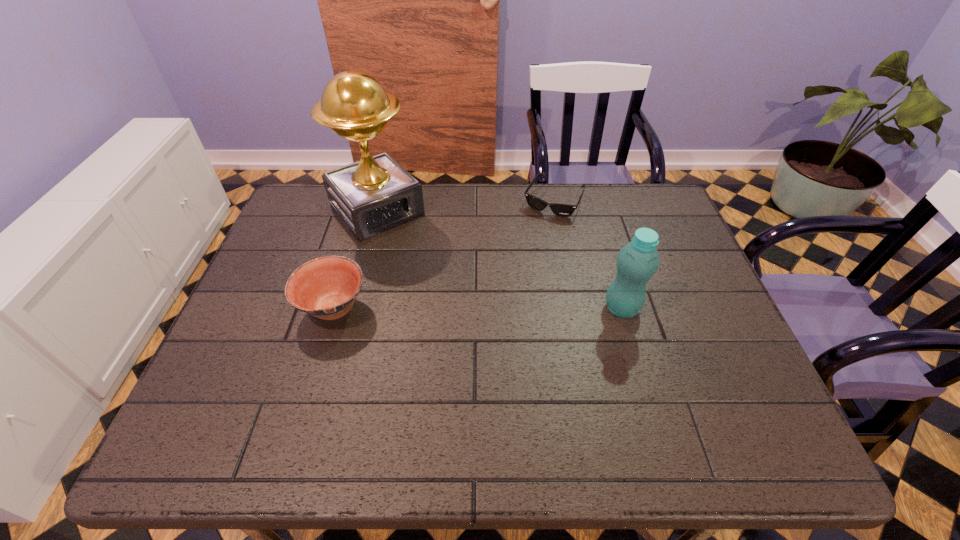
Where is `free location at the far left corner of the desktop`? The height and width of the screenshot is (540, 960). free location at the far left corner of the desktop is located at coordinates (322, 213).

Where is `vacant point at the far right corner`? This screenshot has width=960, height=540. vacant point at the far right corner is located at coordinates (637, 192).

Where is `vacant space at the near right corner of the desktop`? vacant space at the near right corner of the desktop is located at coordinates (702, 376).

This screenshot has width=960, height=540. I want to click on empty space that is in between the water bottle and the shortest object, so click(x=588, y=254).

This screenshot has width=960, height=540. What are the coordinates of `vacant area between the bowl and the water bottle` in the screenshot? It's located at (477, 308).

Find the location of a particular element. This screenshot has height=540, width=960. free space between the award and the bowl is located at coordinates (355, 259).

The height and width of the screenshot is (540, 960). In order to click on empty space that is in between the water bottle and the third tallest object in this screenshot , I will do `click(477, 308)`.

Locate an element on the screen. The image size is (960, 540). free area in between the third tallest object and the second tallest object is located at coordinates (477, 308).

Identify the location of unoccupied position between the second shortest object and the third shortest object. (477, 308).

At what (x,y) coordinates should I click in order to perform the action: click on free space between the sunglasses and the tallest object. Please return your answer as a coordinate pair (x, y). Looking at the image, I should click on (466, 205).